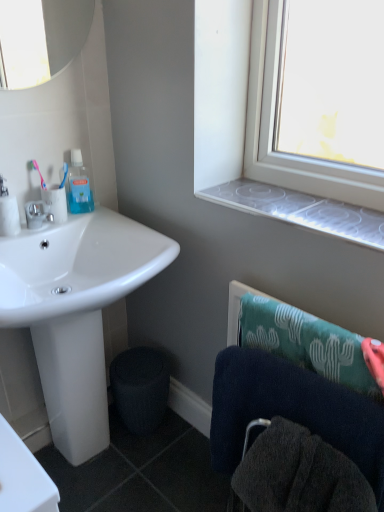
Where is `unoccupied region to the right of transparent plastic mouthwash at upper left`? The width and height of the screenshot is (384, 512). unoccupied region to the right of transparent plastic mouthwash at upper left is located at coordinates (104, 215).